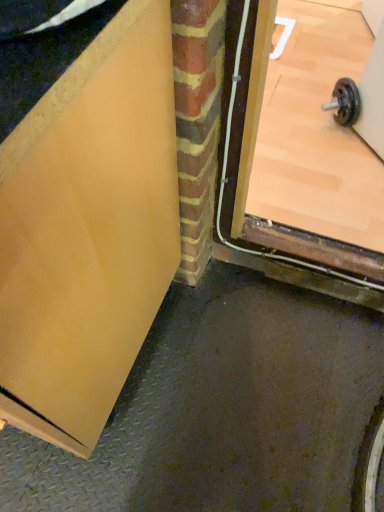
Measure the distance between point (108, 195) and camera.

A distance of 59.10 centimeters exists between point (108, 195) and camera.

Image resolution: width=384 pixels, height=512 pixels. What are the coordinates of `matte yellow door at upper left, which is counted as the first door, starting from the front` in the screenshot? It's located at click(88, 230).

What is the approximate height of matte yellow door at upper left, which is the first door in left-to-right order?

The height of matte yellow door at upper left, which is the first door in left-to-right order, is 35.33 inches.

The height and width of the screenshot is (512, 384). Describe the element at coordinates (88, 230) in the screenshot. I see `matte yellow door at upper left, the 2th door in the right-to-left sequence` at that location.

Measure the distance between matte wood door at center, the second door when ordered from front to back, and camera.

matte wood door at center, the second door when ordered from front to back, and camera are 66.95 centimeters apart from each other.

What do you see at coordinates (282, 255) in the screenshot? I see `matte wood door at center, the second door when ordered from front to back` at bounding box center [282, 255].

At what (x,y) coordinates should I click in order to perform the action: click on matte wood door at center, the 1th door when ordered from right to left. Please return your answer as a coordinate pair (x, y). Looking at the image, I should click on pos(282,255).

In order to face matte wood door at center, the 1th door when ordered from right to left, should I rotate leftwards or rightwards?

You should look right and rotate roughly 16.786 degrees.

The height and width of the screenshot is (512, 384). Find the location of `matte yellow door at upper left, which is the 2th door from back to front`. matte yellow door at upper left, which is the 2th door from back to front is located at coordinates (88, 230).

Does matte wood door at center, the second door when ordered from front to back, appear on the right side of matte yellow door at upper left, which is the first door in left-to-right order?

Yes, matte wood door at center, the second door when ordered from front to back, is to the right of matte yellow door at upper left, which is the first door in left-to-right order.

In the scene shown: In the image, is matte wood door at center, the 1th door when ordered from right to left, positioned in front of or behind matte yellow door at upper left, which is the first door in left-to-right order?

Clearly, matte wood door at center, the 1th door when ordered from right to left, is behind matte yellow door at upper left, which is the first door in left-to-right order.

Is point (343, 281) closer to viewer compared to point (75, 342)?

No, it is not.

From the image's perspective, which is below, matte wood door at center, the 2th door when ordered from left to right, or matte yellow door at upper left, which is the 2th door from back to front?

matte yellow door at upper left, which is the 2th door from back to front, from the image's perspective.

From a real-world perspective, is matte wood door at center, the 1th door when ordered from right to left, positioned above or below matte yellow door at upper left, which is counted as the first door, starting from the front?

Clearly, from a real-world perspective, matte wood door at center, the 1th door when ordered from right to left, is below matte yellow door at upper left, which is counted as the first door, starting from the front.

Can you confirm if matte wood door at center, the 1th door when ordered from right to left, is wider than matte yellow door at upper left, which is the 2th door from back to front?

Yes, matte wood door at center, the 1th door when ordered from right to left, is wider than matte yellow door at upper left, which is the 2th door from back to front.

In terms of height, does matte wood door at center, the 1th door when ordered from right to left, look taller or shorter compared to matte yellow door at upper left, which is the 2th door from back to front?

matte wood door at center, the 1th door when ordered from right to left, is shorter than matte yellow door at upper left, which is the 2th door from back to front.

Considering the sizes of matte wood door at center, the 1th door when ordered from right to left, and matte yellow door at upper left, the 2th door in the right-to-left sequence, in the image, is matte wood door at center, the 1th door when ordered from right to left, bigger or smaller than matte yellow door at upper left, the 2th door in the right-to-left sequence,?

Considering their sizes, matte wood door at center, the 1th door when ordered from right to left, takes up less space than matte yellow door at upper left, the 2th door in the right-to-left sequence.

Which is correct: matte wood door at center, the 2th door when ordered from left to right, is inside matte yellow door at upper left, which is counted as the first door, starting from the front, or outside of it?

matte wood door at center, the 2th door when ordered from left to right, exists outside the volume of matte yellow door at upper left, which is counted as the first door, starting from the front.

Is matte wood door at center, the second door when ordered from front to back, far from matte yellow door at upper left, which is the 2th door from back to front?

That's not correct — matte wood door at center, the second door when ordered from front to back, is a little close to matte yellow door at upper left, which is the 2th door from back to front.

Is matte wood door at center, which appears as the 1th door when viewed from the back, facing towards matte yellow door at upper left, which is the 2th door from back to front?

No.

Identify the location of door above the matte wood door at center, the second door when ordered from front to back (from a real-world perspective). (88, 230).

Does matte yellow door at upper left, which is the first door in left-to-right order, appear on the right side of matte wood door at center, which appears as the 1th door when viewed from the back?

No.

Is matte yellow door at upper left, which is counted as the first door, starting from the front, closer to camera compared to matte wood door at center, which appears as the 1th door when viewed from the back?

That is True.

Which is in front, point (92, 119) or point (217, 223)?

The point (92, 119) is closer to the camera.

From the image's perspective, which is above, matte yellow door at upper left, which is the 2th door from back to front, or matte wood door at center, which appears as the 1th door when viewed from the back?

matte wood door at center, which appears as the 1th door when viewed from the back, is shown above in the image.

From a real-world perspective, is matte yellow door at upper left, which is the 2th door from back to front, above or below matte wood door at center, which appears as the 1th door when viewed from the back?

In terms of real-world spatial position, matte yellow door at upper left, which is the 2th door from back to front, is above matte wood door at center, which appears as the 1th door when viewed from the back.

Looking at this image, in terms of width, does matte yellow door at upper left, which is the 2th door from back to front, look wider or thinner when compared to matte wood door at center, the 1th door when ordered from right to left?

Clearly, matte yellow door at upper left, which is the 2th door from back to front, has less width compared to matte wood door at center, the 1th door when ordered from right to left.

Looking at this image, which of these two, matte yellow door at upper left, the 2th door in the right-to-left sequence, or matte wood door at center, which appears as the 1th door when viewed from the back, stands shorter?

Standing shorter between the two is matte wood door at center, which appears as the 1th door when viewed from the back.

Is matte yellow door at upper left, the 2th door in the right-to-left sequence, smaller than matte wood door at center, which appears as the 1th door when viewed from the back?

No, matte yellow door at upper left, the 2th door in the right-to-left sequence, is not smaller than matte wood door at center, which appears as the 1th door when viewed from the back.

Is matte yellow door at upper left, the 2th door in the right-to-left sequence, positioned beyond the bounds of matte wood door at center, the second door when ordered from front to back?

Absolutely, matte yellow door at upper left, the 2th door in the right-to-left sequence, is external to matte wood door at center, the second door when ordered from front to back.

Is matte yellow door at upper left, the 2th door in the right-to-left sequence, placed right next to matte wood door at center, which appears as the 1th door when viewed from the back?

matte yellow door at upper left, the 2th door in the right-to-left sequence, and matte wood door at center, which appears as the 1th door when viewed from the back, are clearly separated.

Could you tell me if matte yellow door at upper left, the 2th door in the right-to-left sequence, is turned towards matte wood door at center, which appears as the 1th door when viewed from the back?

No.

Can you tell me how much matte yellow door at upper left, which is counted as the first door, starting from the front, and matte wood door at center, the 1th door when ordered from right to left, differ in facing direction?

0.0684 degrees.

How much distance is there between matte yellow door at upper left, which is the first door in left-to-right order, and matte wood door at center, the 2th door when ordered from left to right?

A distance of 40.22 centimeters exists between matte yellow door at upper left, which is the first door in left-to-right order, and matte wood door at center, the 2th door when ordered from left to right.

This screenshot has height=512, width=384. In order to click on door above the matte wood door at center, which appears as the 1th door when viewed from the back (from a real-world perspective) in this screenshot , I will do `click(88, 230)`.

You are a GUI agent. You are given a task and a screenshot of the screen. Output one action in this format:
    pyautogui.click(x=<x>, y=<y>)
    Task: Click on the door above the matte wood door at center, the 1th door when ordered from right to left (from a real-world perspective)
    
    Given the screenshot: What is the action you would take?
    pyautogui.click(x=88, y=230)

Find the location of a particular element. door on the right side of matte yellow door at upper left, which is the 2th door from back to front is located at coordinates (282, 255).